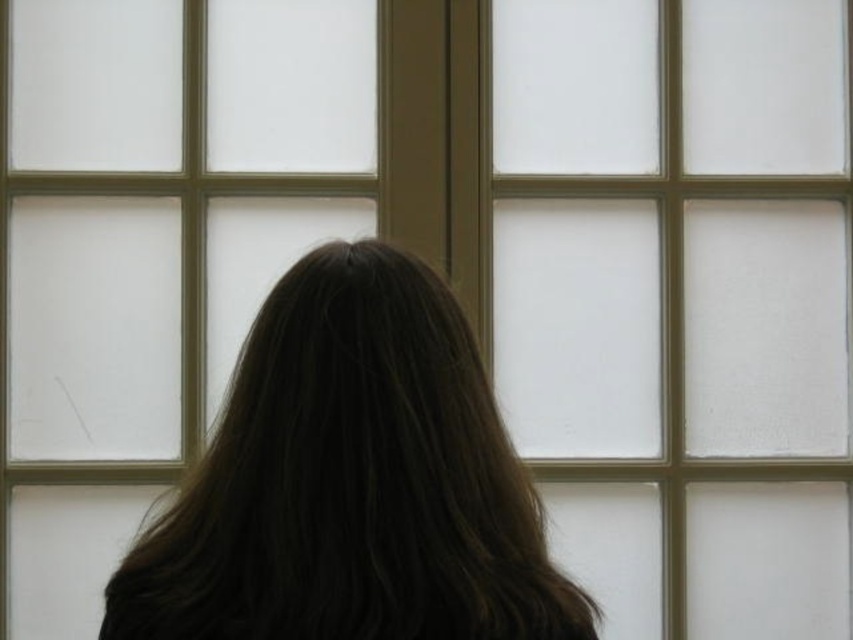
From the picture: You are a photographer standing in a room with a person facing a window. The white frosted glass at center is part of the window they are looking at. You want to take a photo of the person and the window. If your camera requires the subject to be at least 6 feet away to focus properly, will you be able to take the photo without moving closer or farther away?

The distance between the white frosted glass at center and the camera is 6.11 feet, which is slightly more than the required 6 feet. Therefore, the camera should be able to focus properly on the subject without needing to adjust your position.

You are an interior designer assessing the lighting in a room. You notice the white frosted glass at center and the brown hair at center. Which object is taller in the scene?

The white frosted glass at center is taller than the brown hair at center.